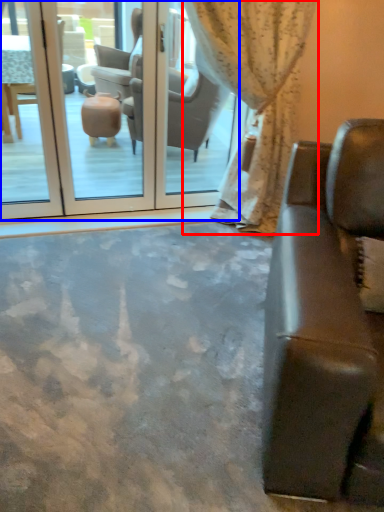
Question: Among these objects, which one is nearest to the camera, curtain (highlighted by a red box) or screen door (highlighted by a blue box)?

Choices:
 (A) curtain
 (B) screen door

Answer: (A)